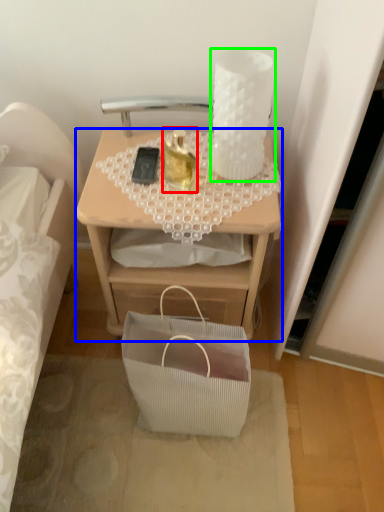
Question: Considering the real-world distances, which object is farthest from candle holder (highlighted by a red box)? desk (highlighted by a blue box) or candle holder (highlighted by a green box)?

Choices:
 (A) desk
 (B) candle holder

Answer: (A)